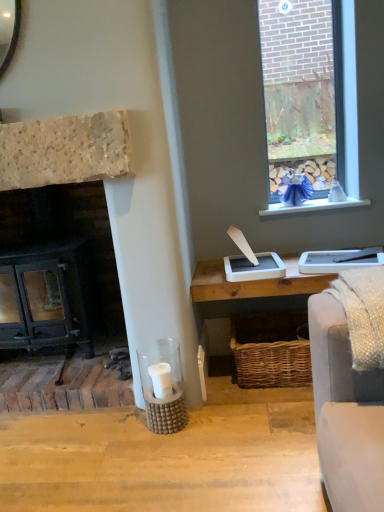
Question: Can you confirm if white painted wood at upper right is thinner than black cast iron fireplace at left?

Choices:
 (A) yes
 (B) no

Answer: (A)

Question: Is white painted wood at upper right beside black cast iron fireplace at left?

Choices:
 (A) yes
 (B) no

Answer: (B)

Question: Does white painted wood at upper right turn towards black cast iron fireplace at left?

Choices:
 (A) no
 (B) yes

Answer: (A)

Question: Can you confirm if white painted wood at upper right is positioned to the right of black cast iron fireplace at left?

Choices:
 (A) yes
 (B) no

Answer: (A)

Question: Is white painted wood at upper right positioned in front of black cast iron fireplace at left?

Choices:
 (A) yes
 (B) no

Answer: (B)

Question: From the image's perspective, is white painted wood at upper right located beneath black cast iron fireplace at left?

Choices:
 (A) no
 (B) yes

Answer: (A)

Question: Can white painted wood at upper right be found inside black cast iron fireplace at left?

Choices:
 (A) yes
 (B) no

Answer: (B)

Question: Can you confirm if black cast iron fireplace at left is thinner than white painted wood at upper right?

Choices:
 (A) yes
 (B) no

Answer: (B)

Question: From a real-world perspective, does black cast iron fireplace at left sit lower than white painted wood at upper right?

Choices:
 (A) no
 (B) yes

Answer: (B)

Question: Considering the relative sizes of black cast iron fireplace at left and white painted wood at upper right in the image provided, is black cast iron fireplace at left wider than white painted wood at upper right?

Choices:
 (A) no
 (B) yes

Answer: (B)

Question: Considering the relative sizes of black cast iron fireplace at left and white painted wood at upper right in the image provided, is black cast iron fireplace at left shorter than white painted wood at upper right?

Choices:
 (A) no
 (B) yes

Answer: (A)

Question: Is black cast iron fireplace at left located outside white painted wood at upper right?

Choices:
 (A) no
 (B) yes

Answer: (B)

Question: Looking at the image, does white painted wood at upper right seem bigger or smaller compared to black cast iron fireplace at left?

Choices:
 (A) big
 (B) small

Answer: (B)